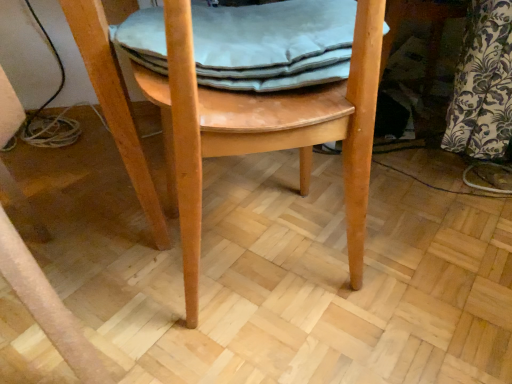
Question: Is light brown wood chair at center in front of or behind light gray fabric cushion at center in the image?

Choices:
 (A) behind
 (B) front

Answer: (B)

Question: From a real-world perspective, relative to light gray fabric cushion at center, is light brown wood chair at center vertically above or below?

Choices:
 (A) above
 (B) below

Answer: (B)

Question: Based on their positions, is light brown wood chair at center located to the left or right of light gray fabric cushion at center?

Choices:
 (A) right
 (B) left

Answer: (B)

Question: Considering the positions of point (226, 44) and point (357, 77), is point (226, 44) closer or farther from the camera than point (357, 77)?

Choices:
 (A) farther
 (B) closer

Answer: (A)

Question: Based on their positions, is light gray fabric cushion at center located to the left or right of light brown wood chair at center?

Choices:
 (A) left
 (B) right

Answer: (B)

Question: Is light gray fabric cushion at center spatially inside light brown wood chair at center, or outside of it?

Choices:
 (A) inside
 (B) outside

Answer: (A)

Question: Considering the positions of light gray fabric cushion at center and light brown wood chair at center in the image, is light gray fabric cushion at center taller or shorter than light brown wood chair at center?

Choices:
 (A) short
 (B) tall

Answer: (A)